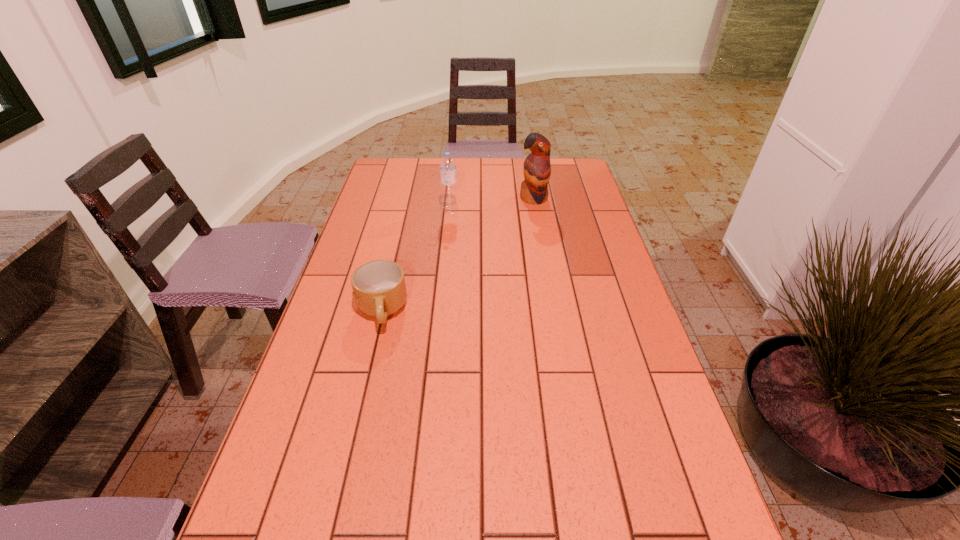
The width and height of the screenshot is (960, 540). In order to click on free space at the far edge in this screenshot , I will do `click(511, 160)`.

Find the location of a particular element. The image size is (960, 540). free region at the left edge of the desktop is located at coordinates (330, 452).

In order to click on vacant space at the right edge of the desktop in this screenshot , I will do `click(578, 248)`.

I want to click on vacant space in between the leftmost object and the second tallest object, so click(416, 260).

Image resolution: width=960 pixels, height=540 pixels. Find the location of `vacant area that lies between the nearest object and the parrot`. vacant area that lies between the nearest object and the parrot is located at coordinates (458, 255).

I want to click on free space that is in between the mug and the rightmost object, so click(458, 255).

Where is `vacant space that's between the tallest object and the leftmost object`? The height and width of the screenshot is (540, 960). vacant space that's between the tallest object and the leftmost object is located at coordinates (458, 255).

At what (x,y) coordinates should I click in order to perform the action: click on empty location between the rightmost object and the nearest object. Please return your answer as a coordinate pair (x, y). The height and width of the screenshot is (540, 960). Looking at the image, I should click on (458, 255).

Locate an element on the screen. object that is the closest to the nearest object is located at coordinates (448, 173).

Locate which object ranks in proximity to the second shortest object. Please provide its 2D coordinates. Your answer should be formatted as a tuple, i.e. [(x, y)], where the tuple contains the x and y coordinates of a point satisfying the conditions above.

[(537, 169)]